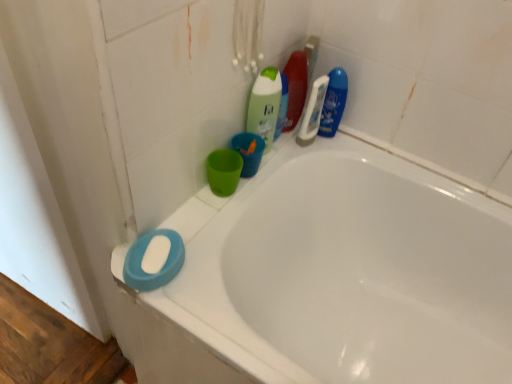
Measure the distance between point (x=323, y=93) and camera.

Point (x=323, y=93) and camera are 3.43 feet apart.

The width and height of the screenshot is (512, 384). Describe the element at coordinates (223, 171) in the screenshot. I see `matte plastic cup at upper center` at that location.

Identify the location of green matte bottle at upper center, the first cleaning product positioned from the left. The height and width of the screenshot is (384, 512). (265, 105).

This screenshot has width=512, height=384. What are the coordinates of `white glossy bathtub at lower left` in the screenshot? It's located at (332, 278).

Where is `white plastic toothbrush at upper center, the second cleaning product when ordered from right to left`? white plastic toothbrush at upper center, the second cleaning product when ordered from right to left is located at coordinates (313, 111).

Identify the location of soap in front of the matte plastic cup at upper center. The width and height of the screenshot is (512, 384). (156, 254).

From a real-world perspective, is white matte soap at lower left physically above matte plastic cup at upper center?

No, from a real-world perspective, white matte soap at lower left is not over matte plastic cup at upper center

From the image's perspective, which is above, white matte soap at lower left or matte plastic cup at upper center?

matte plastic cup at upper center, from the image's perspective.

Who is bigger, green matte bottle at upper center, the fourth cleaning product when ordered from right to left, or blue glossy bottle at upper right, which is the 1th cleaning product from right to left?

With larger size is green matte bottle at upper center, the fourth cleaning product when ordered from right to left.

Is green matte bottle at upper center, the fourth cleaning product when ordered from right to left, behind blue glossy bottle at upper right, the 4th cleaning product from the left?

No.

Which is less distant, [253,115] or [342,102]?

Positioned in front is point [253,115].

Which of these two, green matte bottle at upper center, the first cleaning product positioned from the left, or blue glossy bottle at upper right, which is the 1th cleaning product from right to left, stands shorter?

With less height is blue glossy bottle at upper right, which is the 1th cleaning product from right to left.

Between white plastic toothbrush at upper center, the third cleaning product when ordered from left to right, and matte plastic cup at upper center, which one has smaller size?

Smaller between the two is matte plastic cup at upper center.

Is white plastic toothbrush at upper center, the second cleaning product when ordered from right to left, beside matte plastic cup at upper center?

There is a gap between white plastic toothbrush at upper center, the second cleaning product when ordered from right to left, and matte plastic cup at upper center.

From a real-world perspective, between white plastic toothbrush at upper center, the second cleaning product when ordered from right to left, and matte plastic cup at upper center, who is vertically higher?

In real-world perspective, white plastic toothbrush at upper center, the second cleaning product when ordered from right to left, is above.

Does point (324, 96) come closer to viewer compared to point (220, 180)?

That is False.

From the image's perspective, which object appears higher, white glossy bathtub at lower left or green matte bottle at upper center, the first cleaning product positioned from the left?

green matte bottle at upper center, the first cleaning product positioned from the left, is shown above in the image.

At what (x,y) coordinates should I click in order to perform the action: click on the 1st cleaning product behind the white glossy bathtub at lower left, counting from the anchor's position. Please return your answer as a coordinate pair (x, y). Looking at the image, I should click on [x=265, y=105].

Can you confirm if white glossy bathtub at lower left is wider than green matte bottle at upper center, the first cleaning product positioned from the left?

Yes, white glossy bathtub at lower left is wider than green matte bottle at upper center, the first cleaning product positioned from the left.

From a real-world perspective, is white glossy bathtub at lower left on top of green matte bottle at upper center, the fourth cleaning product when ordered from right to left?

No, from a real-world perspective, white glossy bathtub at lower left is not over green matte bottle at upper center, the fourth cleaning product when ordered from right to left

Is white plastic toothbrush at upper center, the second cleaning product when ordered from right to left, at the back of blue glossy bottle at upper right, the 4th cleaning product from the left?

No.

Is the depth of blue glossy bottle at upper right, which is the 1th cleaning product from right to left, less than that of white plastic toothbrush at upper center, the third cleaning product when ordered from left to right?

No, blue glossy bottle at upper right, which is the 1th cleaning product from right to left, is further to the viewer.

Which object is positioned more to the right, blue glossy bottle at upper right, which is the 1th cleaning product from right to left, or white plastic toothbrush at upper center, the third cleaning product when ordered from left to right?

From the viewer's perspective, blue glossy bottle at upper right, which is the 1th cleaning product from right to left, appears more on the right side.

Identify the location of the 1st cleaning product positioned above the white plastic toothbrush at upper center, the third cleaning product when ordered from left to right (from the image's perspective). click(x=333, y=102).

From a real-world perspective, is translucent plastic bottle at upper center, which is counted as the second cleaning product, starting from the left, physically above white plastic toothbrush at upper center, the second cleaning product when ordered from right to left?

Yes, from a real-world perspective, translucent plastic bottle at upper center, which is counted as the second cleaning product, starting from the left, is above white plastic toothbrush at upper center, the second cleaning product when ordered from right to left.

Does translucent plastic bottle at upper center, the third cleaning product positioned from the right, have a greater width compared to white plastic toothbrush at upper center, the second cleaning product when ordered from right to left?

Indeed, translucent plastic bottle at upper center, the third cleaning product positioned from the right, has a greater width compared to white plastic toothbrush at upper center, the second cleaning product when ordered from right to left.

From the image's perspective, is translucent plastic bottle at upper center, the third cleaning product positioned from the right, under white plastic toothbrush at upper center, the third cleaning product when ordered from left to right?

Actually, translucent plastic bottle at upper center, the third cleaning product positioned from the right, appears above white plastic toothbrush at upper center, the third cleaning product when ordered from left to right, in the image.

Is translucent plastic bottle at upper center, which is counted as the second cleaning product, starting from the left, not near white plastic toothbrush at upper center, the third cleaning product when ordered from left to right?

Actually, translucent plastic bottle at upper center, which is counted as the second cleaning product, starting from the left, and white plastic toothbrush at upper center, the third cleaning product when ordered from left to right, are a little close together.

Which is closer, [296,95] or [269,142]?

Clearly, point [296,95] is more distant from the camera than point [269,142].

Looking at the image, does translucent plastic bottle at upper center, the third cleaning product positioned from the right, seem bigger or smaller compared to green matte bottle at upper center, the fourth cleaning product when ordered from right to left?

Clearly, translucent plastic bottle at upper center, the third cleaning product positioned from the right, is smaller in size than green matte bottle at upper center, the fourth cleaning product when ordered from right to left.

Considering the relative sizes of translucent plastic bottle at upper center, which is counted as the second cleaning product, starting from the left, and green matte bottle at upper center, the fourth cleaning product when ordered from right to left, in the image provided, is translucent plastic bottle at upper center, which is counted as the second cleaning product, starting from the left, thinner than green matte bottle at upper center, the fourth cleaning product when ordered from right to left,?

Yes.

Where is `soap in front of the matte plastic cup at upper center`? This screenshot has width=512, height=384. soap in front of the matte plastic cup at upper center is located at coordinates (156, 254).

From the blue glossy bottle at upper right, the 4th cleaning product from the left, count the 3rd cleaning product to the left and point to it. Please provide its 2D coordinates.

[(265, 105)]

Based on their spatial positions, is white glossy bathtub at lower left or blue glossy bottle at upper right, the 4th cleaning product from the left, further from white plastic toothbrush at upper center, the second cleaning product when ordered from right to left?

Among the two, white glossy bathtub at lower left is located further to white plastic toothbrush at upper center, the second cleaning product when ordered from right to left.

When comparing their distances from matte plastic cup at upper center, does green matte bottle at upper center, the fourth cleaning product when ordered from right to left, or white matte soap at lower left seem closer?

green matte bottle at upper center, the fourth cleaning product when ordered from right to left, lies closer to matte plastic cup at upper center than the other object.

Based on their spatial positions, is white glossy bathtub at lower left or matte plastic cup at upper center further from translucent plastic bottle at upper center, the third cleaning product positioned from the right?

white glossy bathtub at lower left.

Considering their positions, is translucent plastic bottle at upper center, the third cleaning product positioned from the right, positioned further to green matte bottle at upper center, the fourth cleaning product when ordered from right to left, than white plastic toothbrush at upper center, the second cleaning product when ordered from right to left?

Among the two, white plastic toothbrush at upper center, the second cleaning product when ordered from right to left, is located further to green matte bottle at upper center, the fourth cleaning product when ordered from right to left.

Based on their spatial positions, is white glossy bathtub at lower left or white plastic toothbrush at upper center, the second cleaning product when ordered from right to left, further from green matte bottle at upper center, the first cleaning product positioned from the left?

white glossy bathtub at lower left is positioned further to the anchor green matte bottle at upper center, the first cleaning product positioned from the left.

Which object lies further to the anchor point white plastic toothbrush at upper center, the second cleaning product when ordered from right to left, green matte bottle at upper center, the fourth cleaning product when ordered from right to left, or translucent plastic bottle at upper center, the third cleaning product positioned from the right?

The object further to white plastic toothbrush at upper center, the second cleaning product when ordered from right to left, is green matte bottle at upper center, the fourth cleaning product when ordered from right to left.

Considering their positions, is green matte bottle at upper center, the first cleaning product positioned from the left, positioned closer to white plastic toothbrush at upper center, the second cleaning product when ordered from right to left, than blue glossy bottle at upper right, the 4th cleaning product from the left?

blue glossy bottle at upper right, the 4th cleaning product from the left.

From the image, which object appears to be nearer to white glossy bathtub at lower left, translucent plastic bottle at upper center, the third cleaning product positioned from the right, or green matte bottle at upper center, the first cleaning product positioned from the left?

A: green matte bottle at upper center, the first cleaning product positioned from the left, is positioned closer to the anchor white glossy bathtub at lower left.

The width and height of the screenshot is (512, 384). I want to click on cleaning product between white plastic toothbrush at upper center, the second cleaning product when ordered from right to left, and white glossy bathtub at lower left from top to bottom, so click(265, 105).

Locate an element on the screen. The width and height of the screenshot is (512, 384). teal between green matte bottle at upper center, the first cleaning product positioned from the left, and white glossy bathtub at lower left, in the vertical direction is located at coordinates (223, 171).

This screenshot has width=512, height=384. In order to click on soap between translucent plastic bottle at upper center, which is counted as the second cleaning product, starting from the left, and white glossy bathtub at lower left vertically in this screenshot , I will do `click(156, 254)`.

The width and height of the screenshot is (512, 384). What are the coordinates of `teal between white matte soap at lower left and white glossy bathtub at lower left` in the screenshot? It's located at (223, 171).